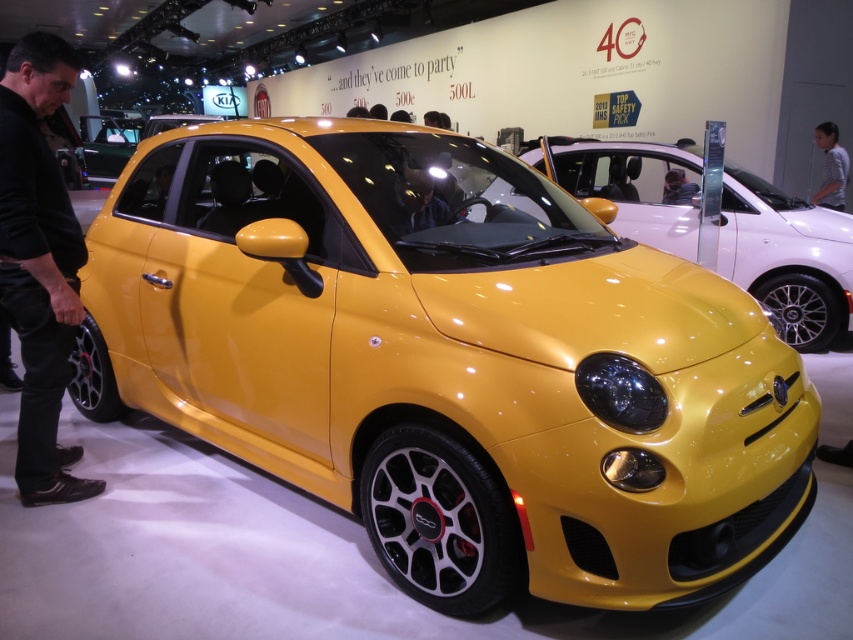
Question: Is black leather pants at lower left below gray striped shirt at center?

Choices:
 (A) yes
 (B) no

Answer: (A)

Question: Based on their relative distances, which object is farther from the gray striped shirt at center?

Choices:
 (A) black leather pants at lower left
 (B) glossy yellow car at center

Answer: (A)

Question: Which point is closer to the camera taking this photo?

Choices:
 (A) (25, 371)
 (B) (845, 154)

Answer: (A)

Question: Where is glossy yellow car at center located in relation to gray striped shirt at center in the image?

Choices:
 (A) right
 (B) left

Answer: (B)

Question: Which point is closer to the camera?

Choices:
 (A) (25, 179)
 (B) (476, 177)
 (C) (828, 205)

Answer: (A)

Question: Does black leather pants at lower left have a lesser width compared to gray striped shirt at center?

Choices:
 (A) no
 (B) yes

Answer: (A)